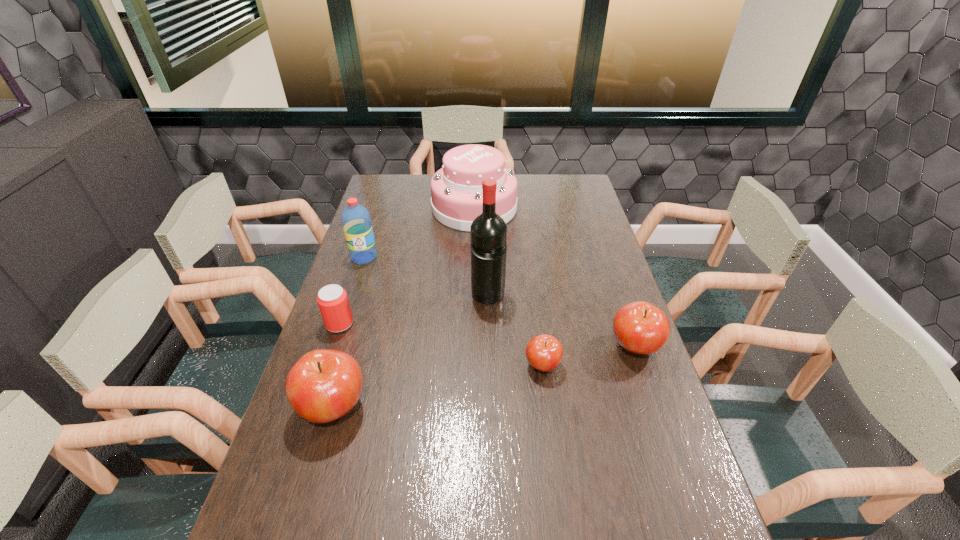
Where is `vacant space that is in between the fifth nearest object and the second apple from left to right`? The image size is (960, 540). vacant space that is in between the fifth nearest object and the second apple from left to right is located at coordinates (516, 330).

At what (x,y) coordinates should I click in order to perform the action: click on vacant space that's between the farthest object and the second farthest object. Please return your answer as a coordinate pair (x, y). Looking at the image, I should click on (420, 232).

The image size is (960, 540). In order to click on vacant area that lies between the shortest object and the leftmost apple in this screenshot , I will do `click(438, 386)`.

Where is `vacant point located between the leftmost apple and the third farthest object`? This screenshot has width=960, height=540. vacant point located between the leftmost apple and the third farthest object is located at coordinates (411, 352).

Find the location of `vacant area that lies between the second farthest object and the beer can`. vacant area that lies between the second farthest object and the beer can is located at coordinates (351, 291).

Where is `free spot between the cake and the rightmost apple`? free spot between the cake and the rightmost apple is located at coordinates (555, 278).

The height and width of the screenshot is (540, 960). I want to click on free space between the cake and the shortest apple, so click(x=509, y=287).

Locate an element on the screen. object that is the fourth closest to the rightmost apple is located at coordinates (323, 385).

Where is `object that stands as the fifth closest to the beer can`? object that stands as the fifth closest to the beer can is located at coordinates (544, 352).

What are the coordinates of `the closest apple to the water bottle` in the screenshot? It's located at (323, 385).